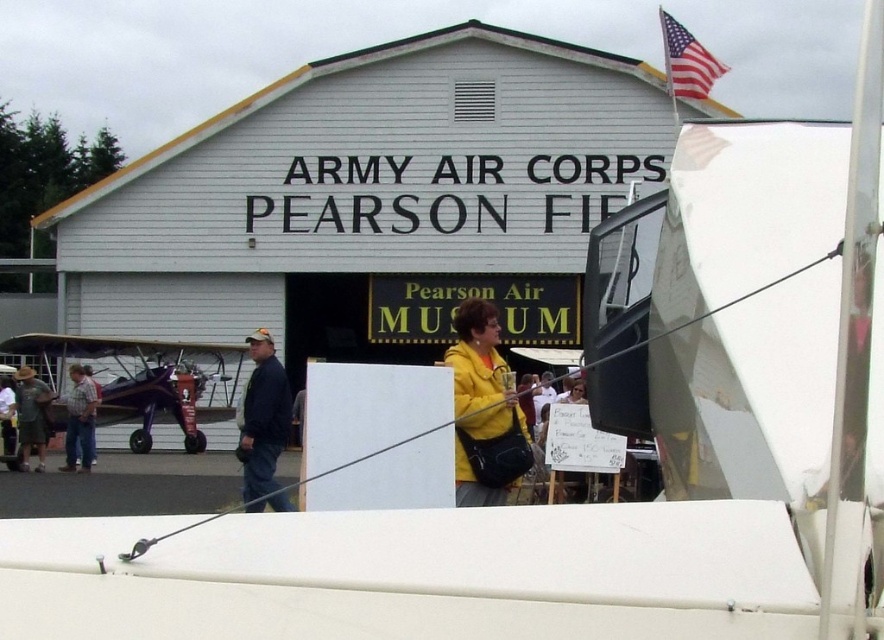
Question: Does plaid shirt at left have a larger size compared to dark blue jeans at center?

Choices:
 (A) no
 (B) yes

Answer: (B)

Question: Among these objects, which one is nearest to the camera?

Choices:
 (A) dark blue jeans at center
 (B) blue denim jeans at center

Answer: (B)

Question: Which of the following is the farthest from the observer?

Choices:
 (A) yellow matte jacket at center
 (B) white matte building at center

Answer: (B)

Question: Which object is the closest to the blue denim jeans at center?

Choices:
 (A) white matte building at center
 (B) dark blue jeans at center
 (C) yellow matte jacket at center
 (D) purple matte biplane at left

Answer: (C)

Question: Is purple matte biplane at left further to the viewer compared to dark blue jeans at center?

Choices:
 (A) no
 (B) yes

Answer: (B)

Question: Does purple matte biplane at left have a larger size compared to dark blue jeans at center?

Choices:
 (A) no
 (B) yes

Answer: (A)